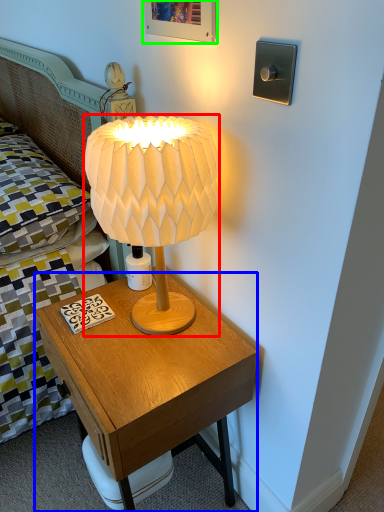
Question: Based on their relative distances, which object is nearer to lamp (highlighted by a red box)? Choose from nightstand (highlighted by a blue box) and picture frame (highlighted by a green box).

Choices:
 (A) nightstand
 (B) picture frame

Answer: (A)